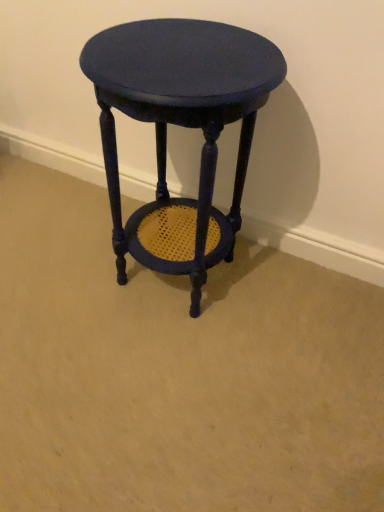
Where is `matte black stool at center`? The image size is (384, 512). matte black stool at center is located at coordinates (181, 126).

The image size is (384, 512). Describe the element at coordinates (181, 126) in the screenshot. I see `matte black stool at center` at that location.

Measure the distance between point (107, 109) and camera.

Point (107, 109) and camera are 32.76 inches apart from each other.

Locate an element on the screen. matte black stool at center is located at coordinates (181, 126).